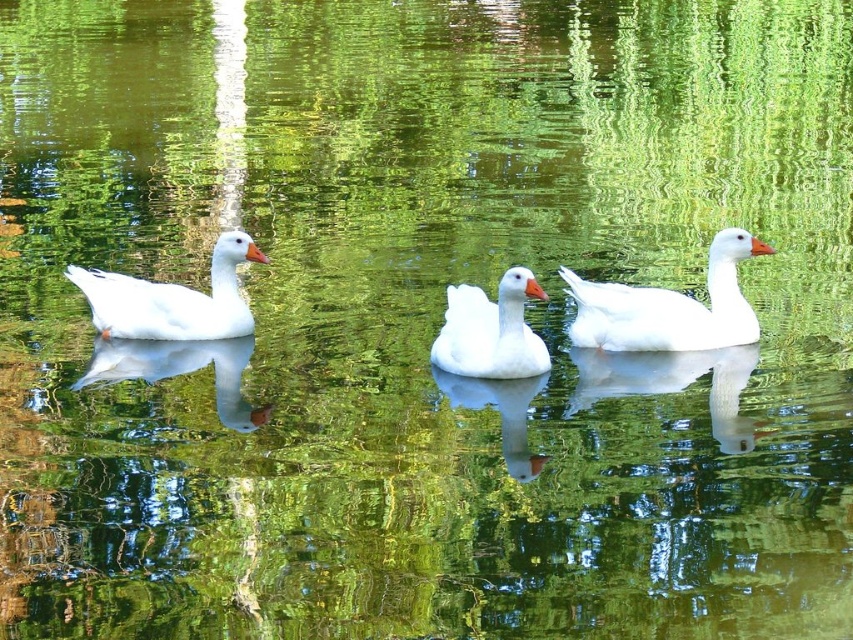
Question: Which object is the closest to the white matte duck at right?

Choices:
 (A) white matte duck at center
 (B) white matte duck at left

Answer: (A)

Question: Among these objects, which one is farthest from the camera?

Choices:
 (A) white matte duck at left
 (B) white matte duck at center

Answer: (A)

Question: Is white matte duck at left thinner than white matte duck at center?

Choices:
 (A) yes
 (B) no

Answer: (B)

Question: Does white matte duck at right appear on the right side of white matte duck at left?

Choices:
 (A) no
 (B) yes

Answer: (B)

Question: Does white matte duck at left appear under white matte duck at center?

Choices:
 (A) yes
 (B) no

Answer: (B)

Question: Which point is farther from the camera taking this photo?

Choices:
 (A) (704, 337)
 (B) (146, 336)

Answer: (B)